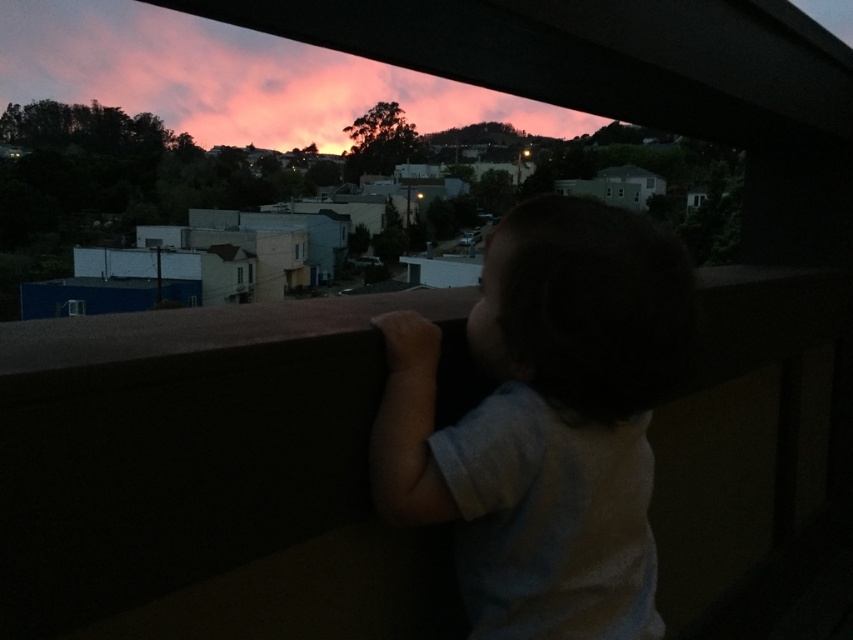
Question: Which point is closer to the camera?

Choices:
 (A) white cotton shirt at center
 (B) pink cotton candy clouds at upper center

Answer: (A)

Question: From the image, what is the correct spatial relationship of white cotton shirt at center in relation to pink cotton candy clouds at upper center?

Choices:
 (A) left
 (B) right

Answer: (B)

Question: Among these points, which one is farthest from the camera?

Choices:
 (A) (64, 81)
 (B) (612, 301)

Answer: (A)

Question: Can you confirm if white cotton shirt at center is positioned above pink cotton candy clouds at upper center?

Choices:
 (A) no
 (B) yes

Answer: (A)

Question: Which point is farther to the camera?

Choices:
 (A) (526, 348)
 (B) (457, 96)

Answer: (B)

Question: Can you confirm if white cotton shirt at center is positioned to the left of pink cotton candy clouds at upper center?

Choices:
 (A) no
 (B) yes

Answer: (A)